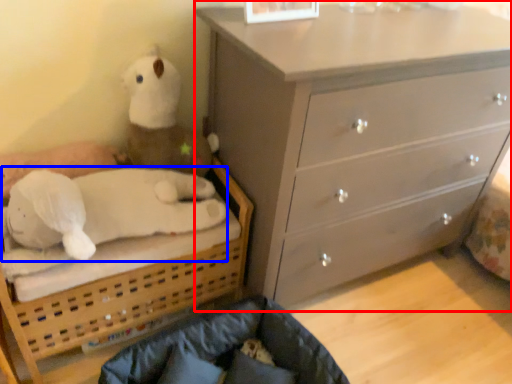
Question: Which of the following is the farthest to the observer, chest of drawers (highlighted by a red box) or animal (highlighted by a blue box)?

Choices:
 (A) chest of drawers
 (B) animal

Answer: (B)